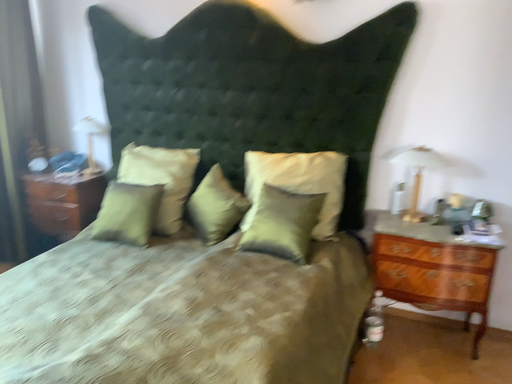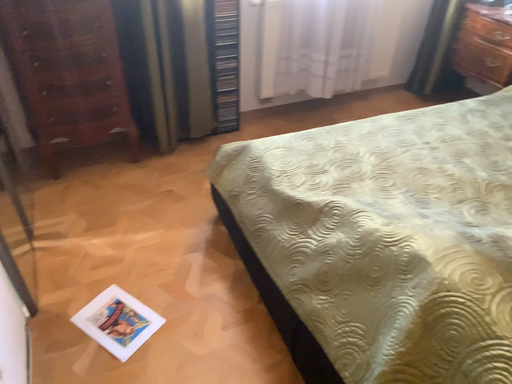
Question: How did the camera likely rotate when shooting the video?

Choices:
 (A) rotated left
 (B) rotated right

Answer: (A)